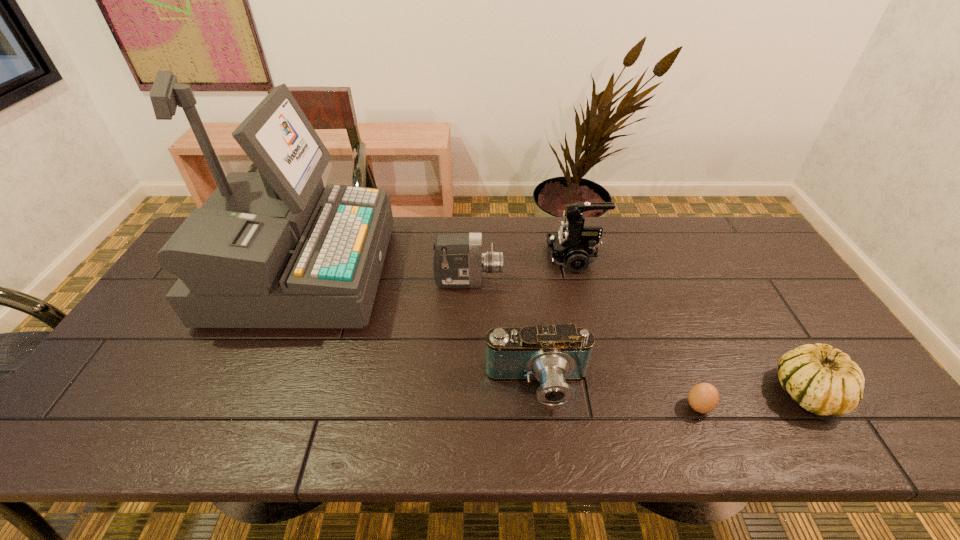
Choose which object is the nearest neighbor to the nearest camcorder. Please provide its 2D coordinates. Your answer should be formatted as a tuple, i.e. [(x, y)], where the tuple contains the x and y coordinates of a point satisfying the conditions above.

[(704, 397)]

Find the location of `object that stands as the fourth closest to the tallest object`. object that stands as the fourth closest to the tallest object is located at coordinates (704, 397).

Find the location of a particular element. camcorder that is the closest to the shortest object is located at coordinates (553, 354).

At what (x,y) coordinates should I click in order to perform the action: click on camcorder object that ranks as the closest to the cash register. Please return your answer as a coordinate pair (x, y). The image size is (960, 540). Looking at the image, I should click on (458, 262).

Locate an element on the screen. free space that satisfies the following two spatial constraints: 1. on the front-facing side of the nearest camcorder; 2. on the left side of the fifth object from left to right is located at coordinates (540, 407).

The height and width of the screenshot is (540, 960). Find the location of `free point that satisfies the following two spatial constraints: 1. on the front-facing side of the second object from right to left; 2. on the right side of the nearest camcorder`. free point that satisfies the following two spatial constraints: 1. on the front-facing side of the second object from right to left; 2. on the right side of the nearest camcorder is located at coordinates (540, 407).

Find the location of a particular element. The height and width of the screenshot is (540, 960). free space that satisfies the following two spatial constraints: 1. on the front-facing side of the nearest camcorder; 2. on the right side of the shortest object is located at coordinates (540, 407).

Identify the location of vacant space that satisfies the following two spatial constraints: 1. on the front-facing side of the boiled egg; 2. on the right side of the nearest camcorder. (540, 407).

Image resolution: width=960 pixels, height=540 pixels. Find the location of `free location that satisfies the following two spatial constraints: 1. on the lens mount of the tallest camcorder; 2. on the left side of the gourd`. free location that satisfies the following two spatial constraints: 1. on the lens mount of the tallest camcorder; 2. on the left side of the gourd is located at coordinates (607, 392).

This screenshot has width=960, height=540. Find the location of `free space that satisfies the following two spatial constraints: 1. on the customer-facing side of the leftmost object; 2. on the right side of the gourd`. free space that satisfies the following two spatial constraints: 1. on the customer-facing side of the leftmost object; 2. on the right side of the gourd is located at coordinates (246, 392).